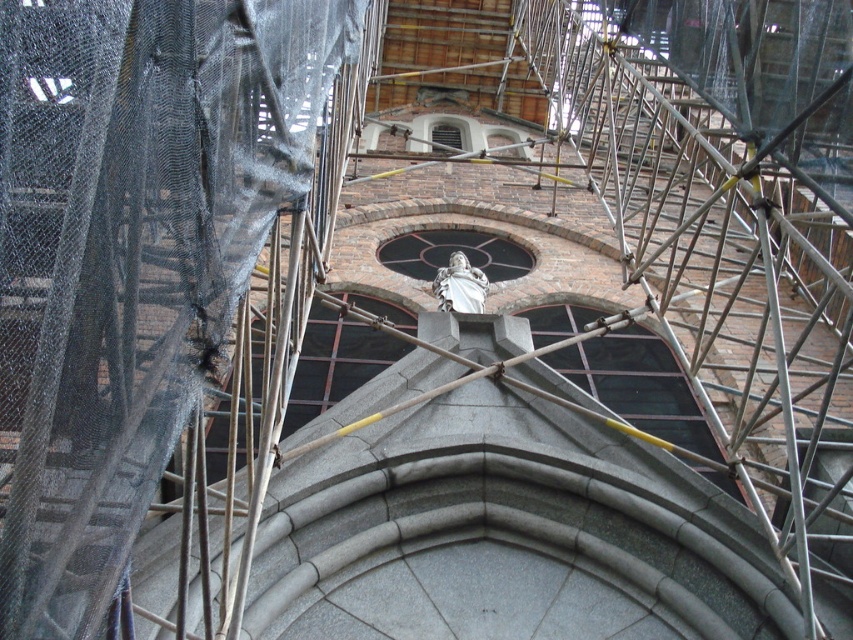
You are an architect evaluating the construction site. You need to determine if the metal scaffolding at center can support the weight of a new heavy beam that will be placed on top of the white marble statue at center. Based on their heights, can the scaffolding accommodate this new beam?

The metal scaffolding at center has a greater height compared to the white marble statue at center, meaning the scaffolding is taller. Since the beam needs to be placed on top of the statue, the scaffolding can reach above the statue to support the beam.

You are standing at the point marked by coordinates point (x=131, y=252) in the image. What structure are you directly at?

The point (x=131, y=252) marks metal scaffolding at center, so you are directly at the metal scaffolding at center.